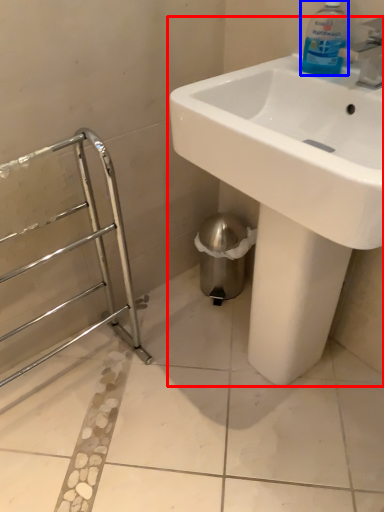
Question: Among these objects, which one is nearest to the camera, sink (highlighted by a red box) or cleaning product (highlighted by a blue box)?

Choices:
 (A) sink
 (B) cleaning product

Answer: (A)